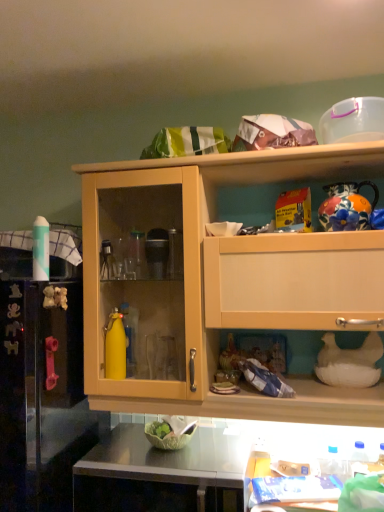
Question: Does metallic stainless steel counter top at lower center appear on the left side of white glossy table at lower center?

Choices:
 (A) no
 (B) yes

Answer: (B)

Question: Considering the relative sizes of metallic stainless steel counter top at lower center and white glossy table at lower center in the image provided, is metallic stainless steel counter top at lower center bigger than white glossy table at lower center?

Choices:
 (A) yes
 (B) no

Answer: (A)

Question: From a real-world perspective, is metallic stainless steel counter top at lower center on top of white glossy table at lower center?

Choices:
 (A) yes
 (B) no

Answer: (B)

Question: Can you confirm if metallic stainless steel counter top at lower center is taller than white glossy table at lower center?

Choices:
 (A) yes
 (B) no

Answer: (A)

Question: Considering the relative positions of metallic stainless steel counter top at lower center and white glossy table at lower center in the image provided, is metallic stainless steel counter top at lower center behind white glossy table at lower center?

Choices:
 (A) yes
 (B) no

Answer: (B)

Question: From the image's perspective, does metallic stainless steel counter top at lower center appear higher than white glossy table at lower center?

Choices:
 (A) yes
 (B) no

Answer: (B)

Question: Does metallic stainless steel counter top at lower center touch light wood cabinet at upper center?

Choices:
 (A) yes
 (B) no

Answer: (B)

Question: Is metallic stainless steel counter top at lower center at the right side of light wood cabinet at upper center?

Choices:
 (A) no
 (B) yes

Answer: (A)

Question: From a real-world perspective, is metallic stainless steel counter top at lower center on top of light wood cabinet at upper center?

Choices:
 (A) no
 (B) yes

Answer: (A)

Question: Can you confirm if metallic stainless steel counter top at lower center is positioned to the left of light wood cabinet at upper center?

Choices:
 (A) no
 (B) yes

Answer: (B)

Question: Is metallic stainless steel counter top at lower center thinner than light wood cabinet at upper center?

Choices:
 (A) no
 (B) yes

Answer: (A)

Question: From the image's perspective, is metallic stainless steel counter top at lower center located beneath light wood cabinet at upper center?

Choices:
 (A) yes
 (B) no

Answer: (A)

Question: Is light wood cabinet at upper center not close to white glossy table at lower center?

Choices:
 (A) no
 (B) yes

Answer: (A)